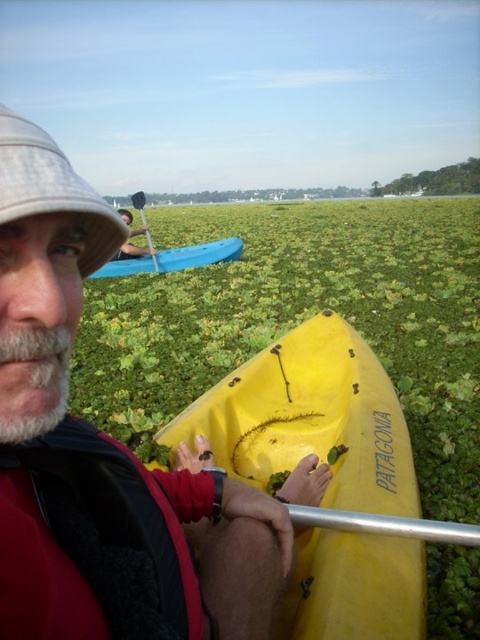
Is white fabric hat at upper left wider than wooden paddle at center?

No, white fabric hat at upper left is not wider than wooden paddle at center.

Consider the image. Does white fabric hat at upper left appear on the left side of wooden paddle at center?

Incorrect, white fabric hat at upper left is not on the left side of wooden paddle at center.

Where is `white fabric hat at upper left`? This screenshot has width=480, height=640. white fabric hat at upper left is located at coordinates (52, 188).

Between point (120, 248) and point (144, 224), which one is positioned in front?

Point (120, 248) is more forward.

The width and height of the screenshot is (480, 640). Identify the location of matte blue kayak at upper left. (132, 252).

Where is `matte yellow kayak at center`? The width and height of the screenshot is (480, 640). matte yellow kayak at center is located at coordinates (43, 273).

Between matte yellow kayak at center and white fabric hat at upper left, which one appears on the right side from the viewer's perspective?

matte yellow kayak at center

Is point (226, 531) closer to viewer compared to point (93, 198)?

No, (226, 531) is behind (93, 198).

Find the location of a particular element. This screenshot has width=480, height=640. matte yellow kayak at center is located at coordinates (43, 273).